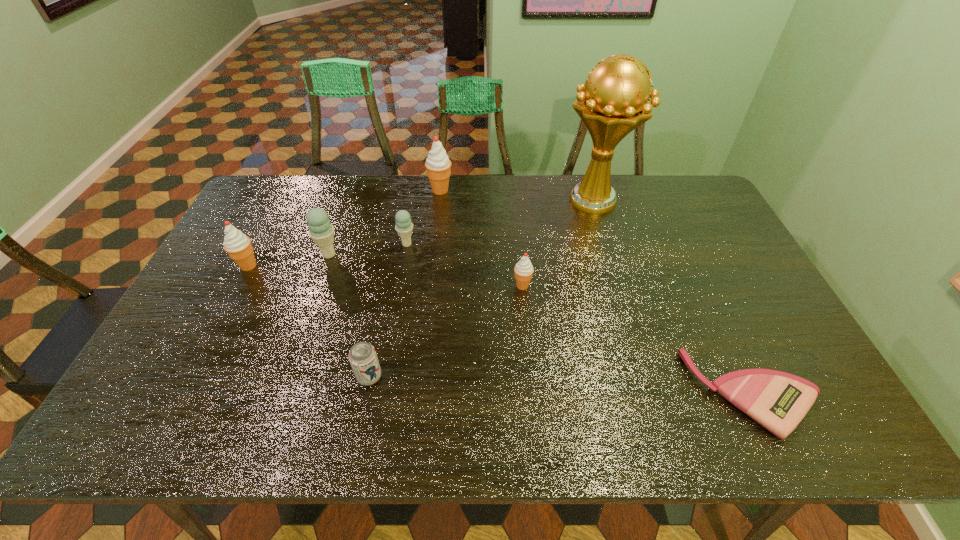
Find the location of a particular element. This screenshot has height=540, width=960. free area in between the shortest object and the third nearest object is located at coordinates (637, 339).

Locate an element on the screen. vacant area that lies between the second shortest object and the leftmost red icecream is located at coordinates (309, 321).

At what (x,y) coordinates should I click in order to perform the action: click on vacant point located between the right blue ice cream and the smallest red icecream. Please return your answer as a coordinate pair (x, y). The height and width of the screenshot is (540, 960). Looking at the image, I should click on (465, 265).

Identify the location of free space between the trophy_cup and the wristlet. (673, 297).

Find the location of a particular element. The width and height of the screenshot is (960, 540). vacant area that lies between the seventh tallest object and the shortest object is located at coordinates (562, 385).

Where is `object that stands as the second closest to the farthest red icecream`? This screenshot has width=960, height=540. object that stands as the second closest to the farthest red icecream is located at coordinates (321, 231).

The width and height of the screenshot is (960, 540). I want to click on object that is the fourth nearest to the nearest red icecream, so click(362, 356).

The height and width of the screenshot is (540, 960). I want to click on icecream identified as the third closest to the biggest red icecream, so click(523, 269).

The width and height of the screenshot is (960, 540). In order to click on the fourth closest icecream to the beer can in this screenshot , I will do `click(238, 246)`.

The width and height of the screenshot is (960, 540). Find the location of `red icecream that is the closest to the beer can`. red icecream that is the closest to the beer can is located at coordinates (523, 269).